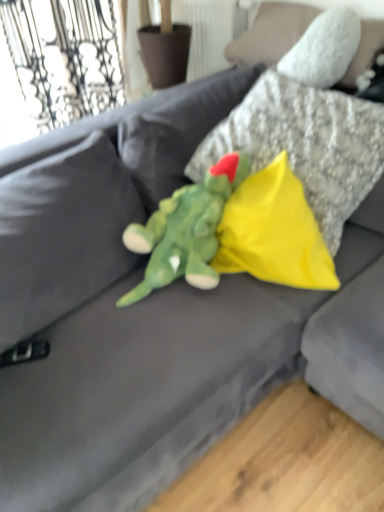
Question: From a real-world perspective, is yellow fabric pillow at center, positioned as the 1th pillow in bottom-to-top order, positioned above or below soft plush dinosaur at center?

Choices:
 (A) below
 (B) above

Answer: (A)

Question: Based on their sizes in the image, would you say yellow fabric pillow at center, which is counted as the second pillow, starting from the top, is bigger or smaller than soft plush dinosaur at center?

Choices:
 (A) small
 (B) big

Answer: (A)

Question: Which is farther from the soft plush dinosaur at center?

Choices:
 (A) yellow fabric pillow at center, the 1th pillow viewed from the top
 (B) yellow fabric pillow at center, which is counted as the second pillow, starting from the top

Answer: (A)

Question: Estimate the real-world distances between objects in this image. Which object is farther from the yellow fabric pillow at center, positioned as the 1th pillow in bottom-to-top order?

Choices:
 (A) yellow fabric pillow at center, the 1th pillow viewed from the top
 (B) soft plush dinosaur at center

Answer: (A)